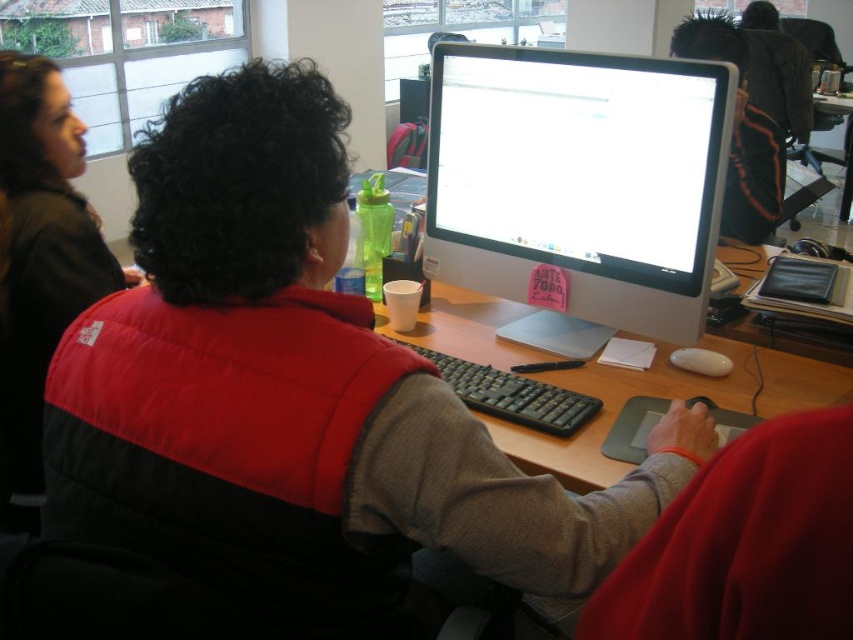
In the scene shown: Is red puffy vest at center above wooden desk at center?

No, red puffy vest at center is not above wooden desk at center.

Does red puffy vest at center appear on the left side of wooden desk at center?

Correct, you'll find red puffy vest at center to the left of wooden desk at center.

Who is more distant from viewer, (x=285, y=240) or (x=756, y=413)?

Positioned behind is point (x=756, y=413).

In order to click on red puffy vest at center in this screenshot , I will do `click(296, 396)`.

Who is shorter, red puffy vest at left or wooden desk at center?

Standing shorter between the two is wooden desk at center.

Which is below, red puffy vest at left or wooden desk at center?

wooden desk at center

At what (x,y) coordinates should I click in order to perform the action: click on red puffy vest at left. Please return your answer as a coordinate pair (x, y). The image size is (853, 640). Looking at the image, I should click on (39, 262).

Which is behind, point (469, 276) or point (459, 362)?

Point (469, 276)

Does white glossy computer monitor at center have a lesser height compared to black plastic keyboard at center?

No.

The height and width of the screenshot is (640, 853). I want to click on white glossy computer monitor at center, so click(x=578, y=179).